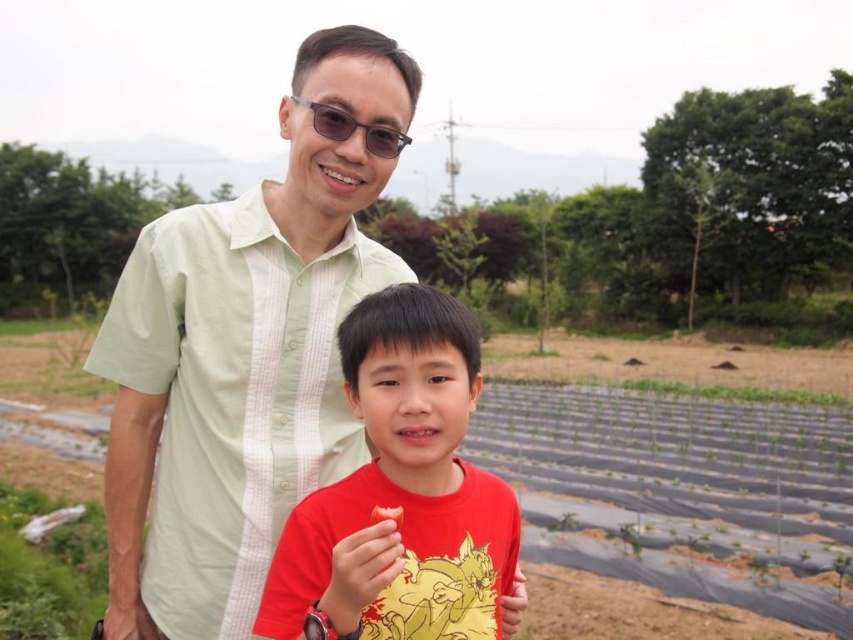
You are standing at the point labeled as point (401, 490) in the image. Looking around, you see the red matte shirt at center and the light green striped shirt behind it. Which direction should you face to see the red matte shirt at center?

You are already facing the red matte shirt at center because the point (401, 490) is on the red matte shirt at center.